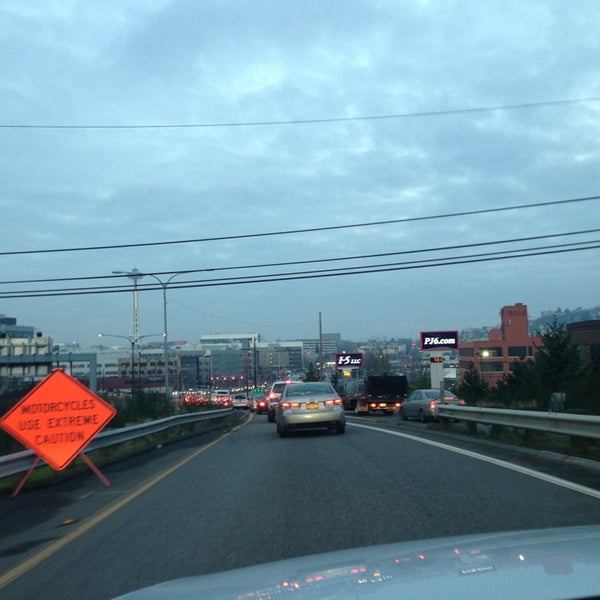
The height and width of the screenshot is (600, 600). What are the coordinates of `wires` in the screenshot? It's located at (309, 119), (293, 232), (298, 262), (297, 272), (298, 277), (274, 328).